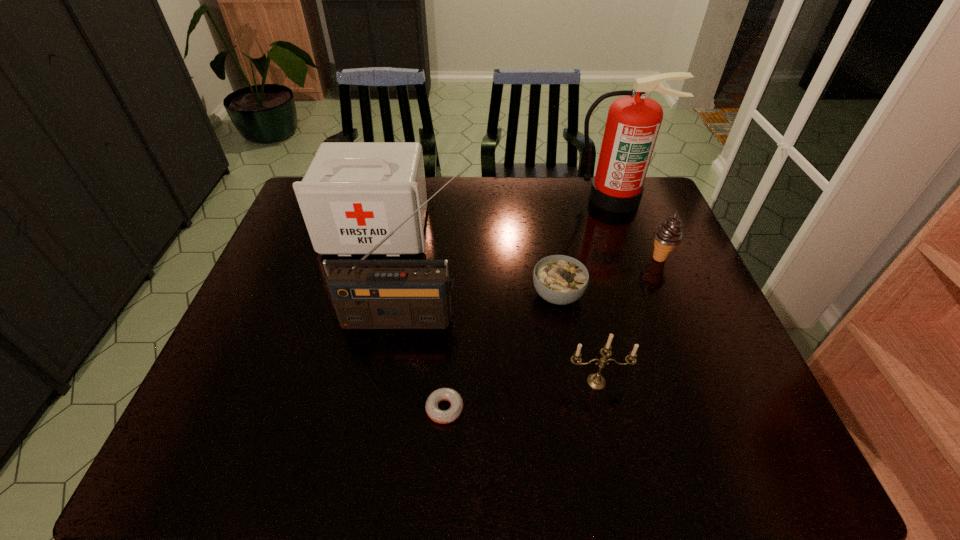
Locate an element on the screen. empty location between the soup bowl and the fifth shortest object is located at coordinates (468, 262).

Locate an element on the screen. The image size is (960, 540). free space between the doughnut and the candle is located at coordinates (520, 395).

Find the location of a particular element. vacant space that's between the second nearest object and the icecream is located at coordinates (628, 320).

This screenshot has height=540, width=960. I want to click on vacant point located between the icecream and the fifth shortest object, so click(518, 244).

I want to click on free point between the doughnut and the second shortest object, so click(501, 352).

At what (x,y) coordinates should I click in order to perform the action: click on vacant area between the icecream and the shortest object. Please return your answer as a coordinate pair (x, y). The image size is (960, 540). Looking at the image, I should click on (552, 333).

Identify the location of free point between the icecream and the radio receiver. This screenshot has height=540, width=960. (531, 288).

Point out which object is positioned as the fourth nearest to the radio receiver. Please provide its 2D coordinates. Your answer should be formatted as a tuple, i.e. [(x, y)], where the tuple contains the x and y coordinates of a point satisfying the conditions above.

[(595, 381)]

At what (x,y) coordinates should I click in order to perform the action: click on object that is the sixth closest to the nearest object. Please return your answer as a coordinate pair (x, y). This screenshot has width=960, height=540. Looking at the image, I should click on (633, 122).

Where is `free space that satisfies the following two spatial constraints: 1. on the back side of the doughnut; 2. on the left side of the candle`? free space that satisfies the following two spatial constraints: 1. on the back side of the doughnut; 2. on the left side of the candle is located at coordinates (446, 382).